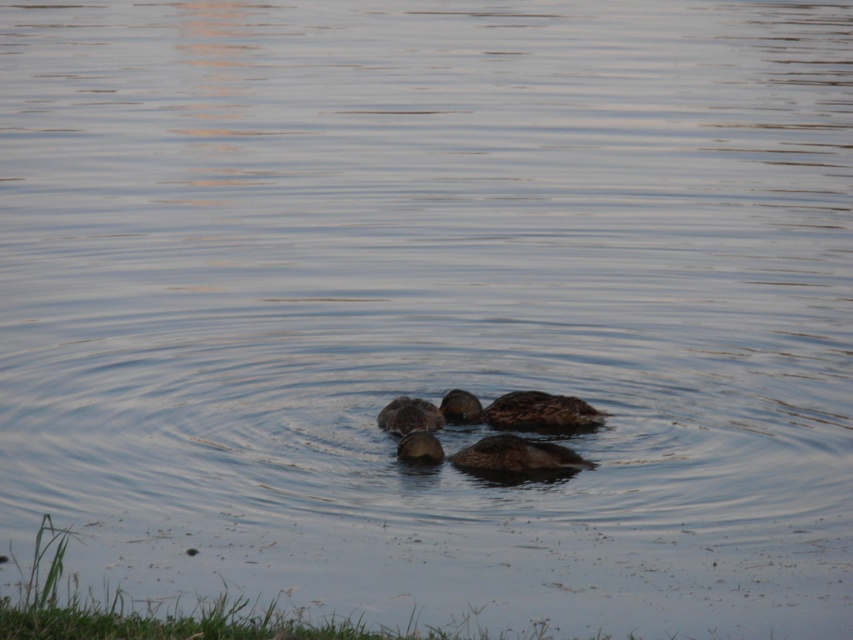
Question: Can you confirm if brown matte duck at center is positioned to the right of brown fuzzy duck at center?

Choices:
 (A) yes
 (B) no

Answer: (A)

Question: Can you confirm if brown fuzzy duck at center is positioned to the right of brown matte duckling at center?

Choices:
 (A) yes
 (B) no

Answer: (B)

Question: Observing the image, what is the correct spatial positioning of dark brown feathers at center in reference to brown matte duckling at center?

Choices:
 (A) right
 (B) left

Answer: (A)

Question: Which point is closer to the camera taking this photo?

Choices:
 (A) (479, 464)
 (B) (398, 449)

Answer: (A)

Question: Among these points, which one is farthest from the camera?

Choices:
 (A) [593, 408]
 (B) [427, 403]

Answer: (A)

Question: Which point appears closest to the camera in this image?

Choices:
 (A) (431, 436)
 (B) (425, 417)
 (C) (556, 394)
 (D) (502, 440)

Answer: (D)